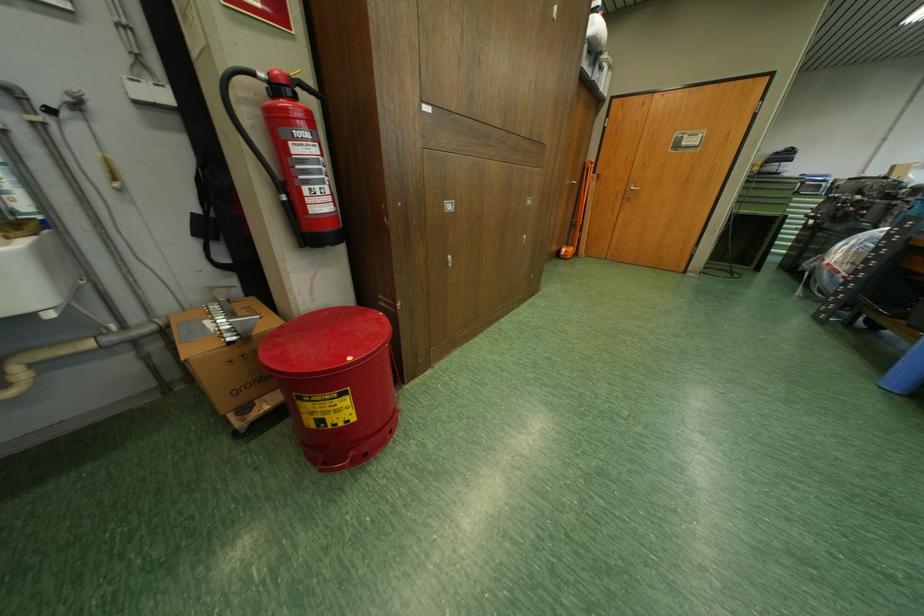
The width and height of the screenshot is (924, 616). What do you see at coordinates (247, 120) in the screenshot?
I see `the fire extinguisher handle` at bounding box center [247, 120].